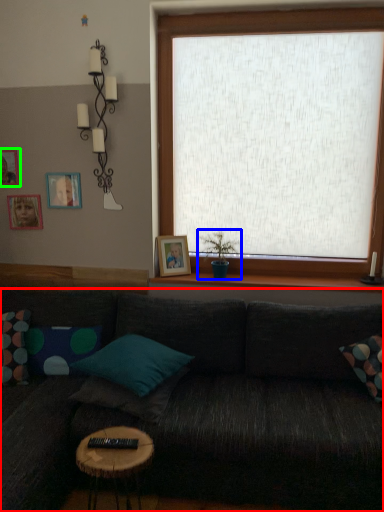
Question: Based on their relative distances, which object is nearer to studio couch (highlighted by a red box)? Choose from houseplant (highlighted by a blue box) and picture frame (highlighted by a green box).

Choices:
 (A) houseplant
 (B) picture frame

Answer: (A)